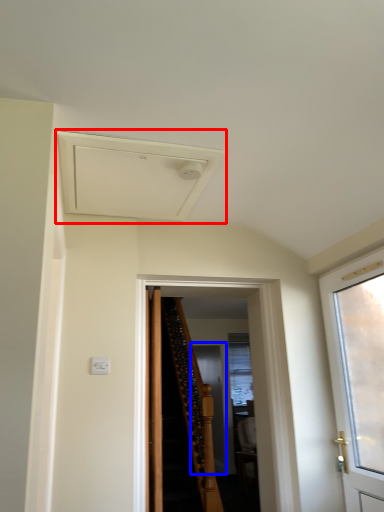
Question: Which point is further to the camera, exhaust hood (highlighted by a red box) or screen door (highlighted by a blue box)?

Choices:
 (A) exhaust hood
 (B) screen door

Answer: (B)